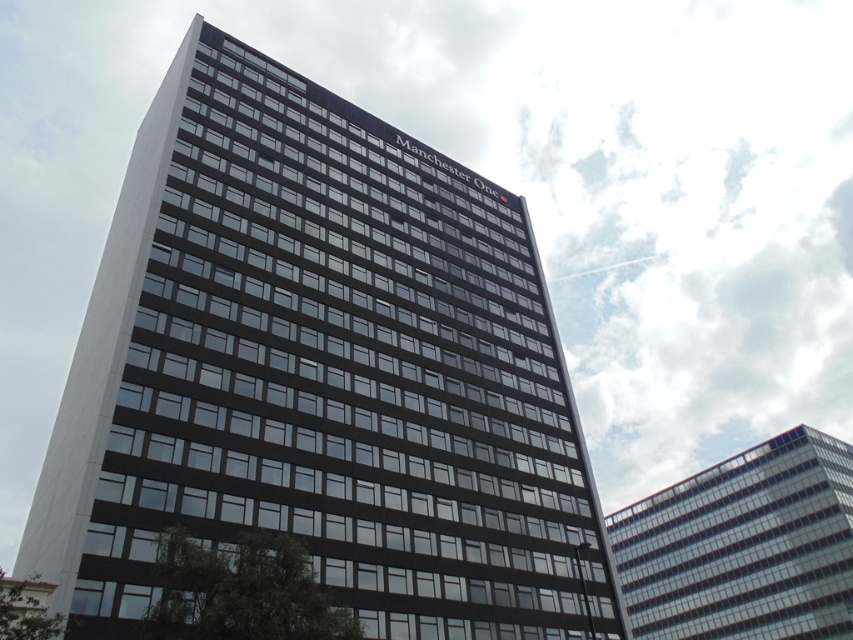
You are standing in front of the Manchester One building and see two points marked on its facade. Which point is closer to you, point at coordinate (555,616) or point at coordinate (786,516)?

Point at coordinate (555,616) is closer to the viewer than point at coordinate (786,516).

You are an architect reviewing the city skyline. You observe the black glass building at center and the transparent glass building at upper right. Which building has a narrower width according to the architectural plans?

The black glass building at center has a lesser width compared to the transparent glass building at upper right, so it is narrower.